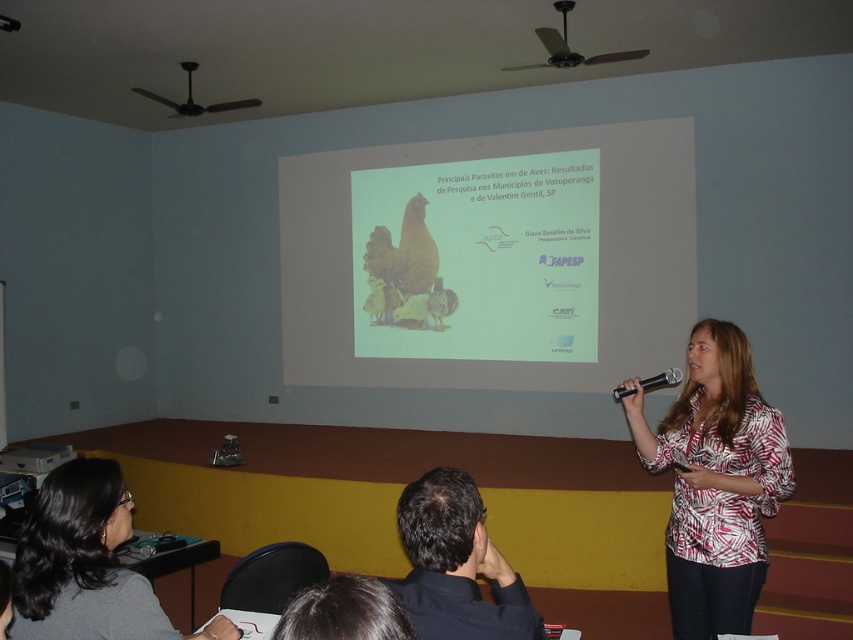
You are an attendee at the presentation and want to ask a question. You need to raise your hand to get the speaker to notice you. Where should you look to ensure you are facing the black plastic microphone at center and the black plastic projector at upper center?

You should look upward towards the black plastic projector at upper center since the black plastic microphone at center is positioned under it, meaning the projector is above the microphone.

You are an attendee at the presentation. You notice the matte white screen at center and the black plastic microphone at center. Which object is larger in size?

The matte white screen at center is bigger than the black plastic microphone at center.

You are an attendee at the presentation and want to take a photo of the slide on the matte white screen at center. However, the black plastic projector at upper center is blocking your view. Is there a way to position yourself so that the projector is not in the frame?

The black plastic projector at upper center is behind the matte white screen at center, so if you position yourself in front of the screen, the projector will be hidden behind it and not visible in your photo.